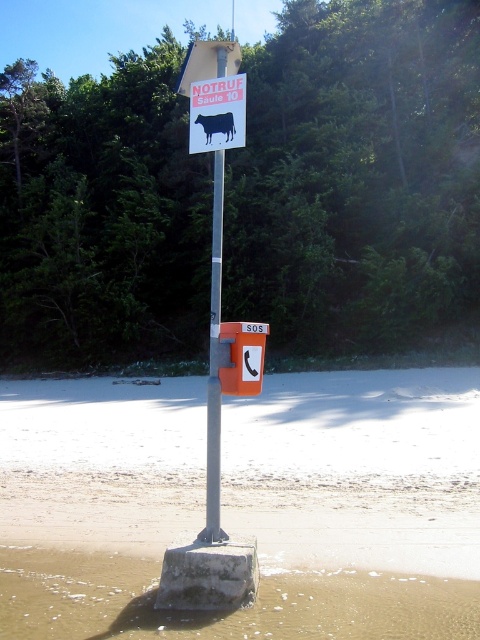
Question: Can you confirm if sandy beach at lower center is thinner than silver metallic pole at center?

Choices:
 (A) yes
 (B) no

Answer: (B)

Question: Does sandy beach at lower center appear under orange plastic sos phone at center?

Choices:
 (A) yes
 (B) no

Answer: (A)

Question: Is silver metallic pole at center behind orange plastic sos phone at center?

Choices:
 (A) no
 (B) yes

Answer: (B)

Question: Which is nearer to the orange plastic sos phone at center?

Choices:
 (A) silver metallic pole at center
 (B) matte plastic sign at center
 (C) sandy beach at lower center
 (D) black matte cow at center

Answer: (D)

Question: Among these objects, which one is nearest to the camera?

Choices:
 (A) silver metallic pole at center
 (B) black matte cow at center
 (C) matte plastic sign at center
 (D) sandy beach at lower center

Answer: (A)

Question: Which object appears closest to the camera in this image?

Choices:
 (A) silver metallic pole at center
 (B) sandy beach at lower center

Answer: (A)